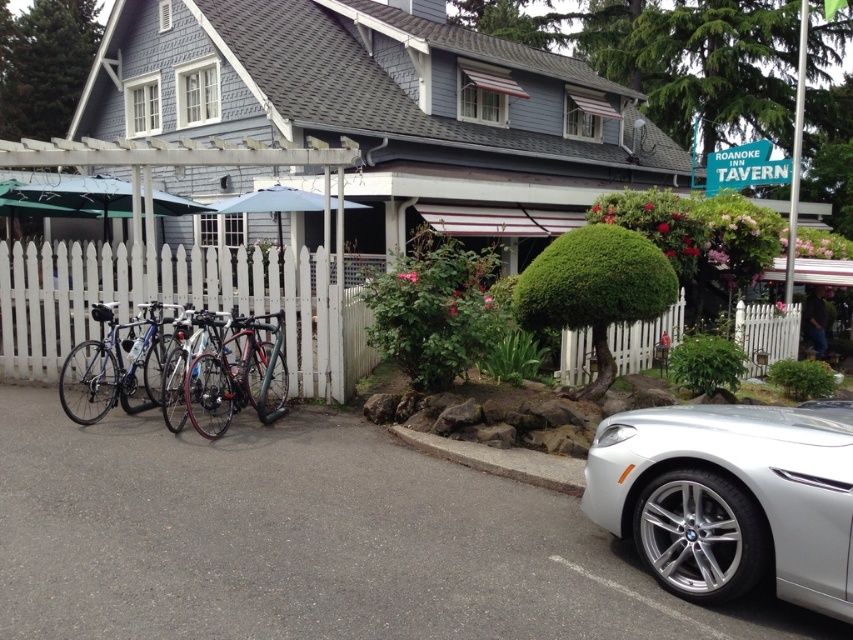
You are a visitor at the Roanoke Inn Tavern and want to park your bicycle. You see two bicycles already parked at the center. Which bicycle takes up more space? The shiny black bicycle at center or the shiny silver bicycle at center?

The shiny black bicycle at center takes up more space since it is larger in size than the shiny silver bicycle at center.